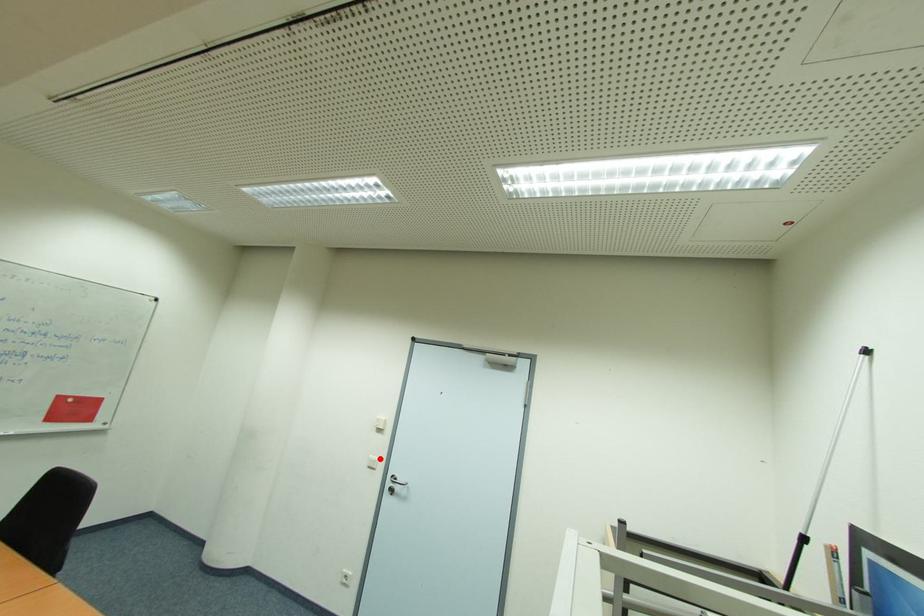
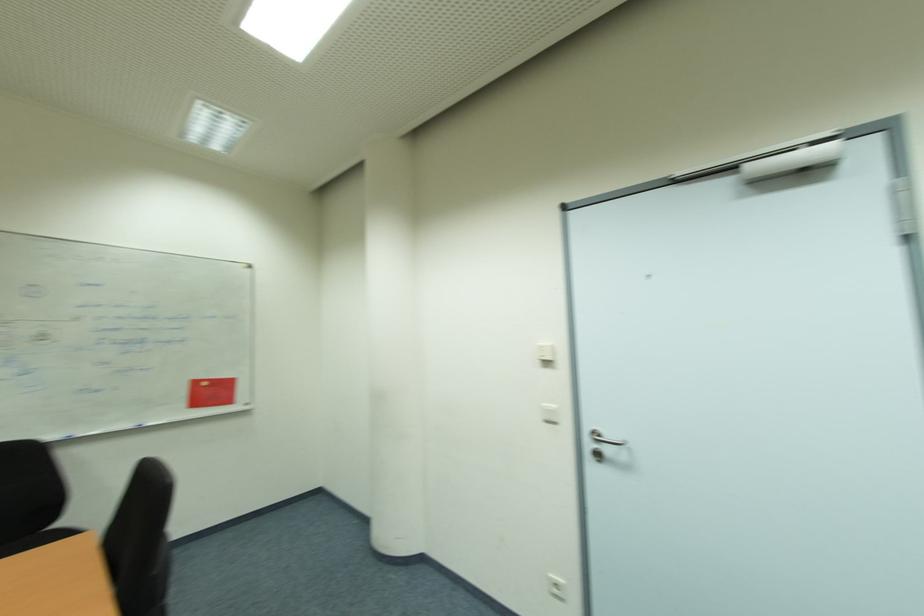
The point at the highlighted location is marked in the first image. Where is the corresponding point in the second image?

(556, 407)